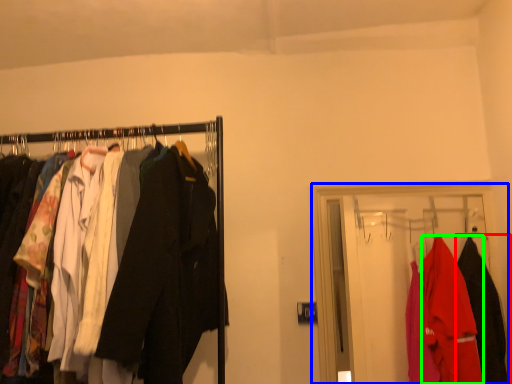
Question: Which is farther away from fancy dress (highlighted by a red box)? closet (highlighted by a blue box) or fancy dress (highlighted by a green box)?

Choices:
 (A) closet
 (B) fancy dress

Answer: (A)